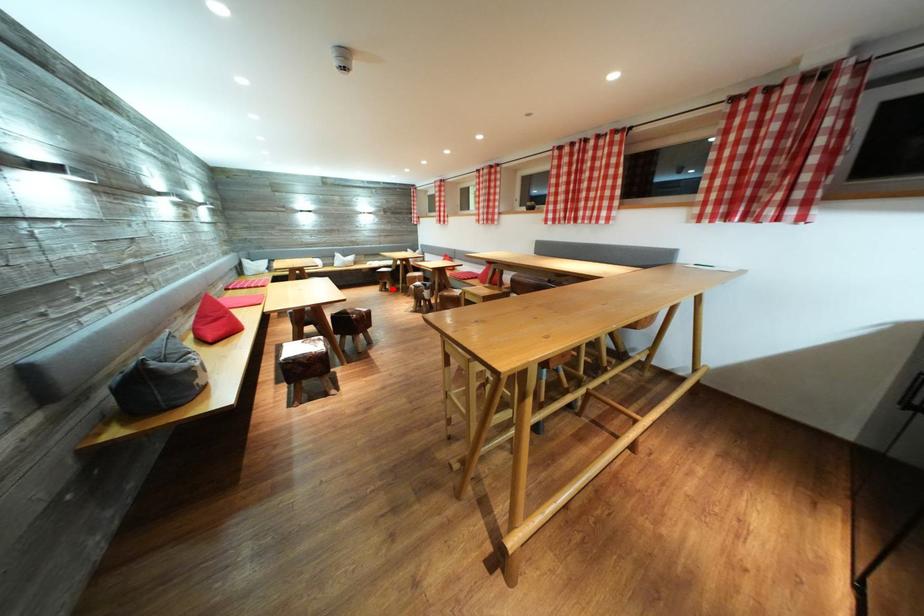
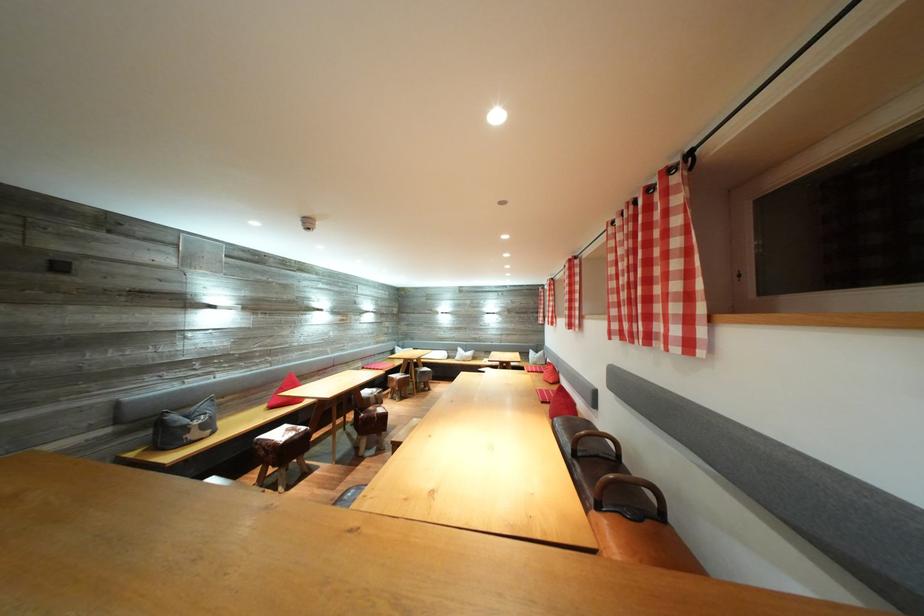
Question: I am providing you with two images of the same scene from different viewpoints. A red point is marked on the first image. Is the red point's position out of view in image 2?

Choices:
 (A) Yes
 (B) No

Answer: (A)